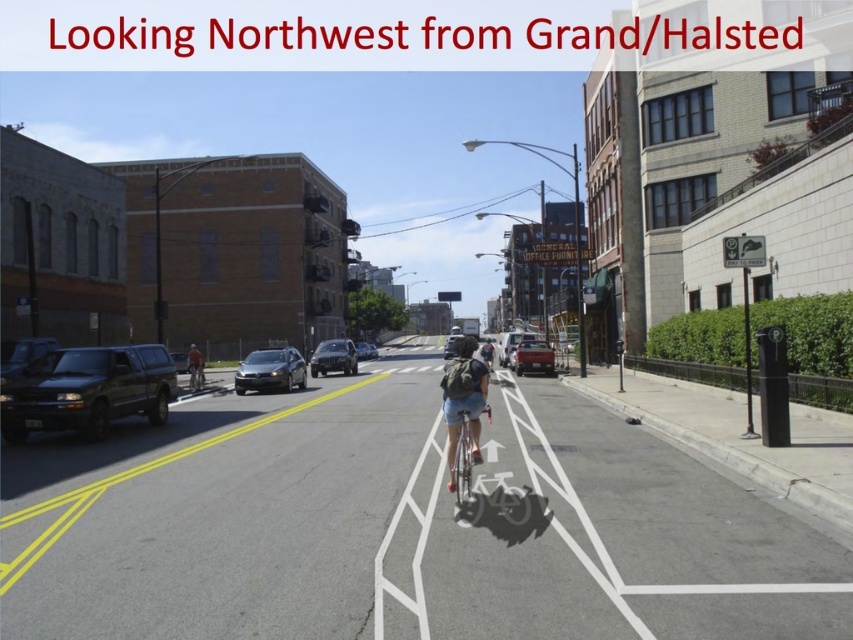
You are a cyclist approaching the scene from the rear. You see the matte red car at center and the dark gray helmet at center. Which object is closer to you as you approach?

The matte red car at center is closer to you than the dark gray helmet at center because it is positioned further to the viewer in the image.

Based on the photo, you are a cyclist approaching the intersection ahead and see a metallic silver bicycle at center and a satin silver suv at center. Which vehicle should you be cautious of first?

You should be cautious of the metallic silver bicycle at center first because it is closer to you than the satin silver suv at center.